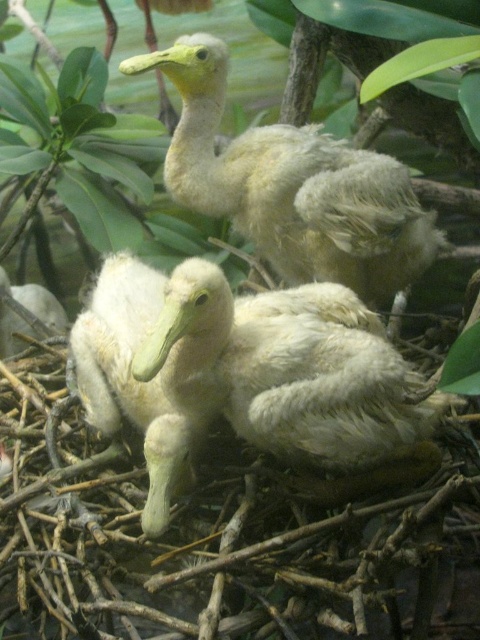
You are a parent duck observing your ducklings in their nest. You notice the soft yellow duckling at center and the white fluffy duckling at left. Which duckling is positioned higher in the nest?

The soft yellow duckling at center is positioned higher in the nest than the white fluffy duckling at left.

You are observing two ducklings in a nest. There is a white fluffy duckling at center and a white fluffy duckling at left. Which duckling is positioned to the right of the other?

The white fluffy duckling at center is positioned to the right of the white fluffy duckling at left.

You are a wildlife photographer aiming to capture a closeup of the soft yellow duckling at center. Based on its position in the image, where should you focus your camera? Please provide the coordinates as a point in the format of x,y.

The soft yellow duckling at center is located at point [291,186], so you should focus your camera there.